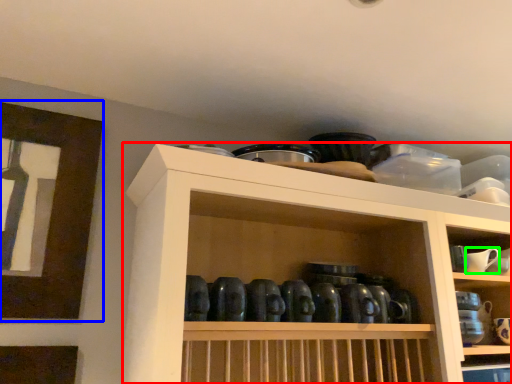
Question: Considering the real-world distances, which object is farthest from shelf (highlighted by a red box)? picture frame (highlighted by a blue box) or tableware (highlighted by a green box)?

Choices:
 (A) picture frame
 (B) tableware

Answer: (B)